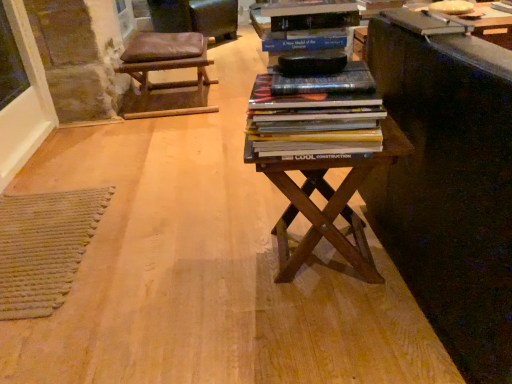
Question: Considering the positions of brown wooden table at center and hardcover book at upper right in the image, is brown wooden table at center taller or shorter than hardcover book at upper right?

Choices:
 (A) tall
 (B) short

Answer: (A)

Question: Is brown wooden table at center bigger or smaller than hardcover book at upper right?

Choices:
 (A) big
 (B) small

Answer: (A)

Question: Which is nearer to the hardcover book at upper right?

Choices:
 (A) brown leather stool at upper left
 (B) brown wooden table at center
 (C) hardcover books at center
 (D) black matte bookshelf at upper center
 (E) brown leather stool at upper left

Answer: (D)

Question: Which of these objects is positioned closest to the brown wooden table at center?

Choices:
 (A) brown leather stool at upper left
 (B) hardcover book at upper right
 (C) hardcover books at center
 (D) black matte bookshelf at upper center
 (E) brown leather stool at upper left

Answer: (C)